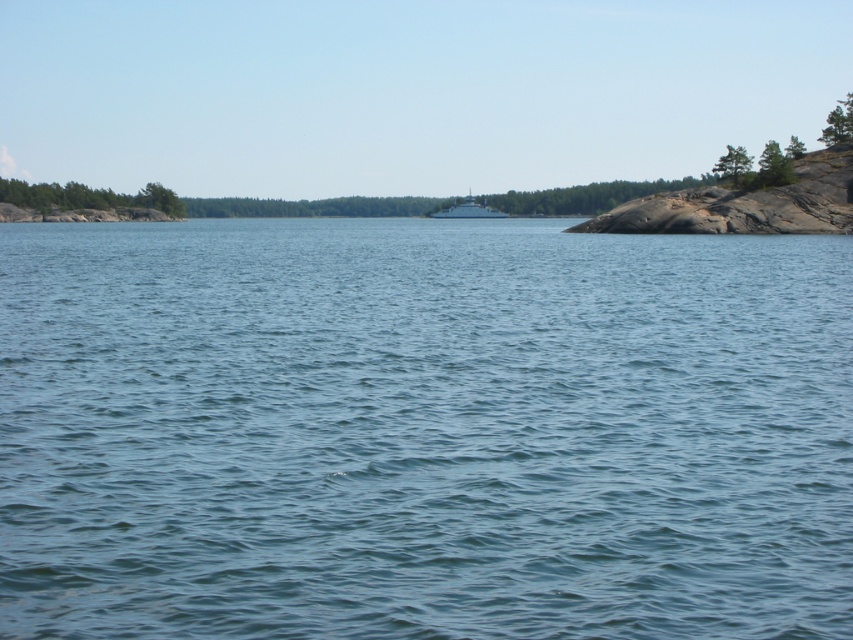
Question: Among these objects, which one is nearest to the camera?

Choices:
 (A) blue water at center
 (B) white glossy boat at center

Answer: (A)

Question: Is blue water at center closer to the viewer compared to white glossy boat at center?

Choices:
 (A) no
 (B) yes

Answer: (B)

Question: Considering the relative positions of blue water at center and white glossy boat at center in the image provided, where is blue water at center located with respect to white glossy boat at center?

Choices:
 (A) right
 (B) left

Answer: (B)

Question: Can you confirm if blue water at center is smaller than white glossy boat at center?

Choices:
 (A) yes
 (B) no

Answer: (B)